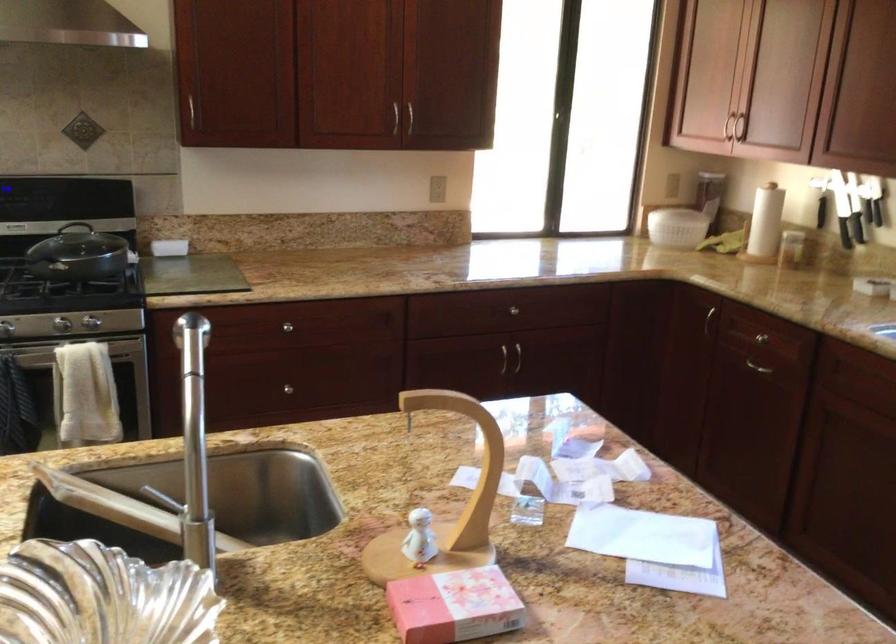
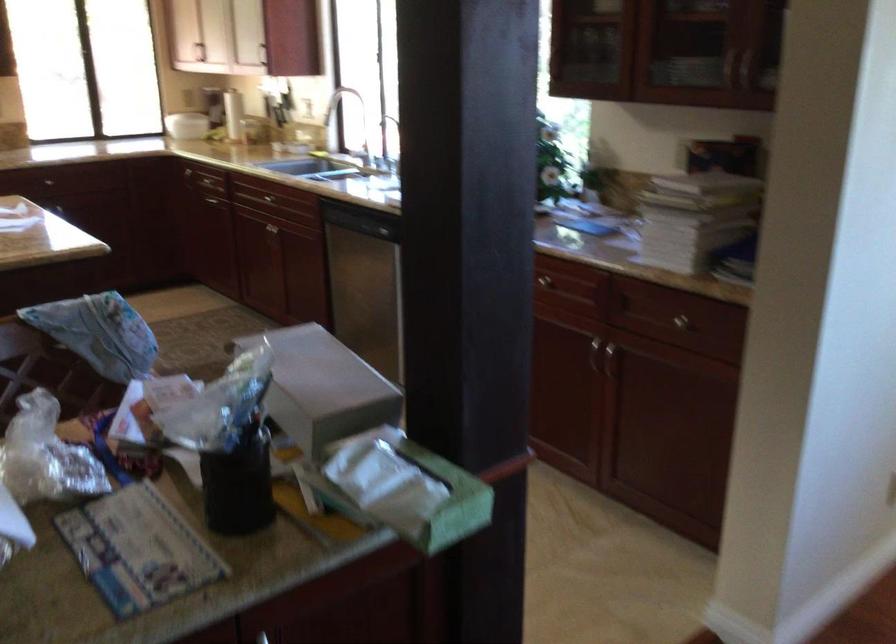
The point at [524,359] is marked in the first image. Where is the corresponding point in the second image?

(65, 207)